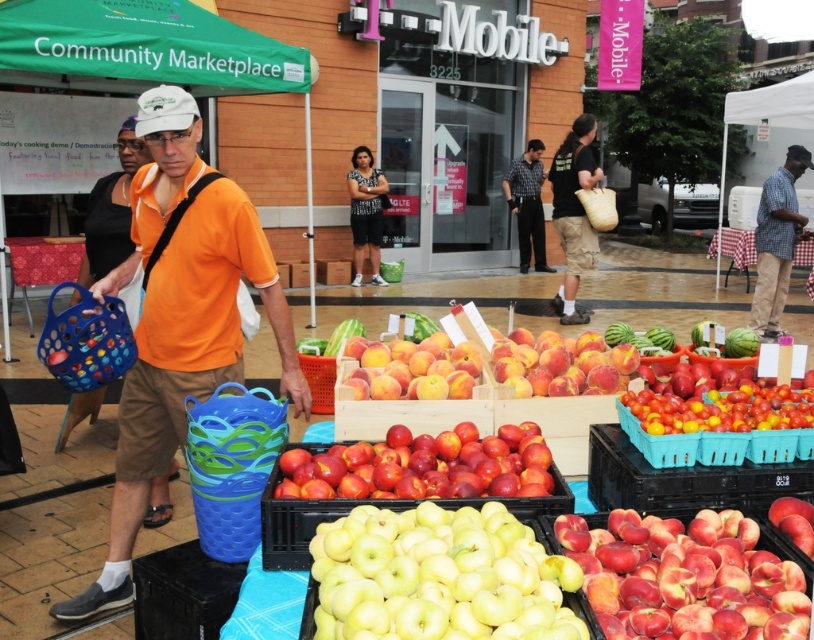
How distant is orange cotton shirt at center from shiny red tomatoes at center?

orange cotton shirt at center and shiny red tomatoes at center are 5.28 feet apart.

Consider the image. Can you confirm if orange cotton shirt at center is shorter than shiny red tomatoes at center?

No, orange cotton shirt at center is not shorter than shiny red tomatoes at center.

Which is behind, point (114, 502) or point (729, 385)?

Positioned behind is point (114, 502).

The width and height of the screenshot is (814, 640). What are the coordinates of `orange cotton shirt at center` in the screenshot? It's located at (178, 317).

Measure the distance between point (x=388, y=502) and camera.

Point (x=388, y=502) is 6.08 feet away from camera.

Is matte plastic crate of apples at center below checkered fabric shirt at right?

Yes.

Where is `matte plastic crate of apples at center`? The width and height of the screenshot is (814, 640). matte plastic crate of apples at center is located at coordinates (300, 524).

Image resolution: width=814 pixels, height=640 pixels. Find the location of `matte plastic crate of apples at center`. matte plastic crate of apples at center is located at coordinates (300, 524).

Does yellow matte apples at center appear on the left side of shiny red tomatoes at center?

Yes, yellow matte apples at center is to the left of shiny red tomatoes at center.

Does point (410, 545) lie behind point (766, 403)?

No, (410, 545) is in front of (766, 403).

You are a GUI agent. You are given a task and a screenshot of the screen. Output one action in this format:
    pyautogui.click(x=<x>, y=<y>)
    Task: Click on the yellow matte apples at center
    Image resolution: width=814 pixels, height=640 pixels.
    Given the screenshot: What is the action you would take?
    pyautogui.click(x=436, y=577)